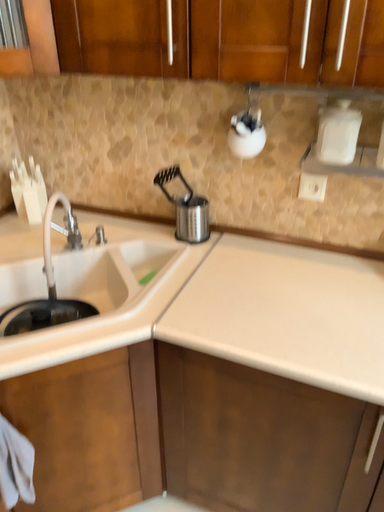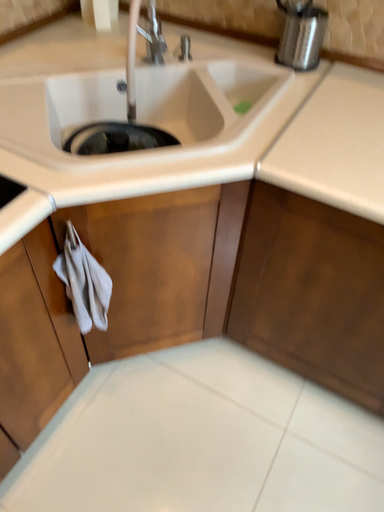
Question: How did the camera likely rotate when shooting the video?

Choices:
 (A) rotated upward
 (B) rotated downward

Answer: (B)